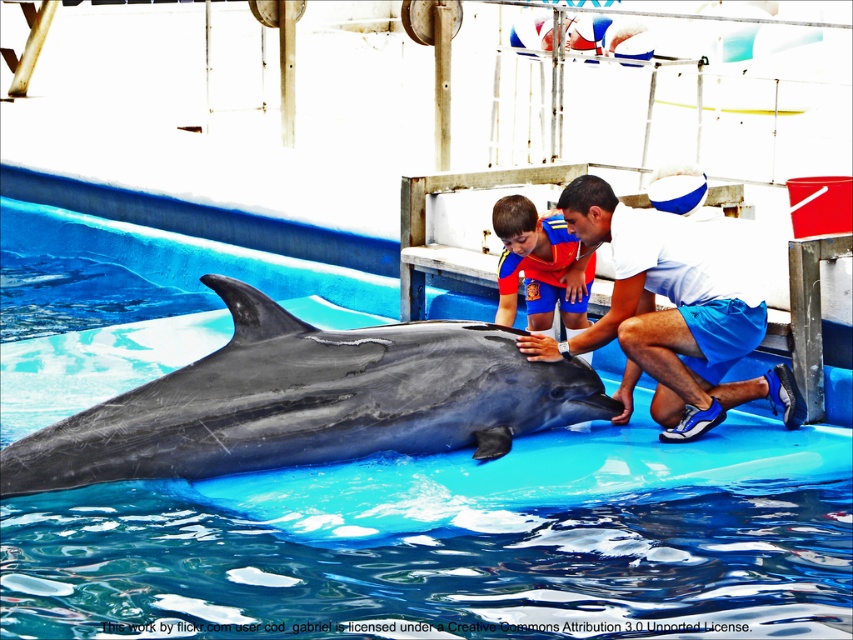
Describe the element at coordinates (428, 566) in the screenshot. I see `blue rubber pool at center` at that location.

Is blue rubber pool at center thinner than gray smooth dolphin at center?

No.

Between point (10, 584) and point (254, 362), which one is positioned in front?

Positioned in front is point (10, 584).

Where is `blue rubber pool at center`? The width and height of the screenshot is (853, 640). blue rubber pool at center is located at coordinates (428, 566).

Which is behind, point (380, 374) or point (682, 291)?

Point (682, 291)

Can you confirm if gray smooth dolphin at center is smaller than white matte shirt at center?

Correct, gray smooth dolphin at center occupies less space than white matte shirt at center.

You are a GUI agent. You are given a task and a screenshot of the screen. Output one action in this format:
    pyautogui.click(x=<x>, y=<y>)
    Task: Click on the gray smooth dolphin at center
    
    Given the screenshot: What is the action you would take?
    pyautogui.click(x=310, y=401)

This screenshot has height=640, width=853. Find the location of `gray smooth dolphin at center`. gray smooth dolphin at center is located at coordinates (310, 401).

Between point (352, 369) and point (555, 298), which one is positioned in front?

Positioned in front is point (352, 369).

Is gray smooth dolphin at center taller than matte blue shorts at center?

No.

Does point (148, 401) lie in front of point (509, 269)?

Yes.

Image resolution: width=853 pixels, height=640 pixels. Identify the location of gray smooth dolphin at center. 310,401.